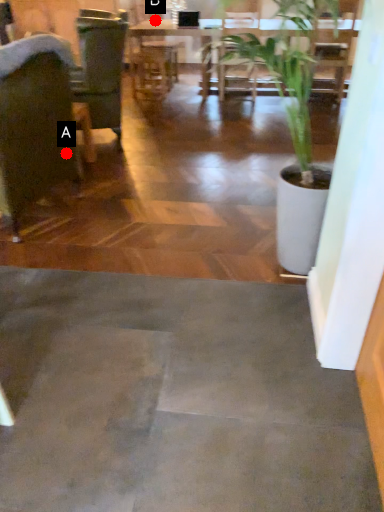
Question: Two points are circled on the image, labeled by A and B beside each circle. Which point is closer to the camera taking this photo?

Choices:
 (A) A is closer
 (B) B is closer

Answer: (A)